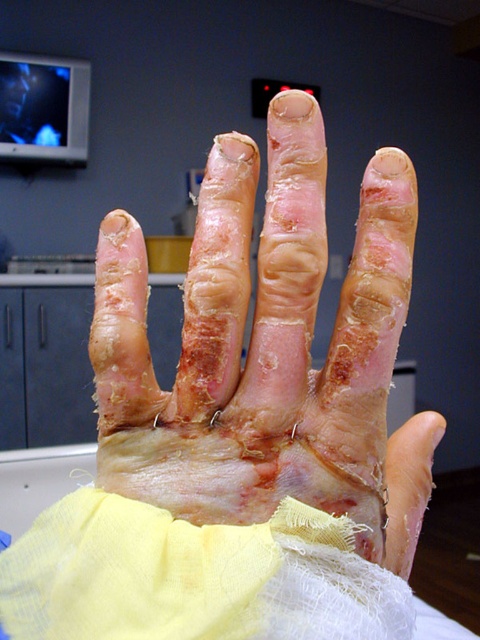
You are a medical professional examining the hand injury. You notice two points marked on the image. The first point is at coordinates point (288,225) and the second is at point (44,618). Which point is closer to the viewer?

Point (44,618) is closer to the viewer because point (288,225) is behind it.